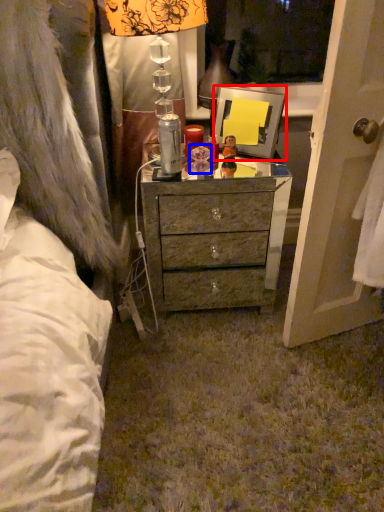
Question: Which object appears closest to the camera in this image, picture frame (highlighted by a red box) or toy (highlighted by a blue box)?

Choices:
 (A) picture frame
 (B) toy

Answer: (A)